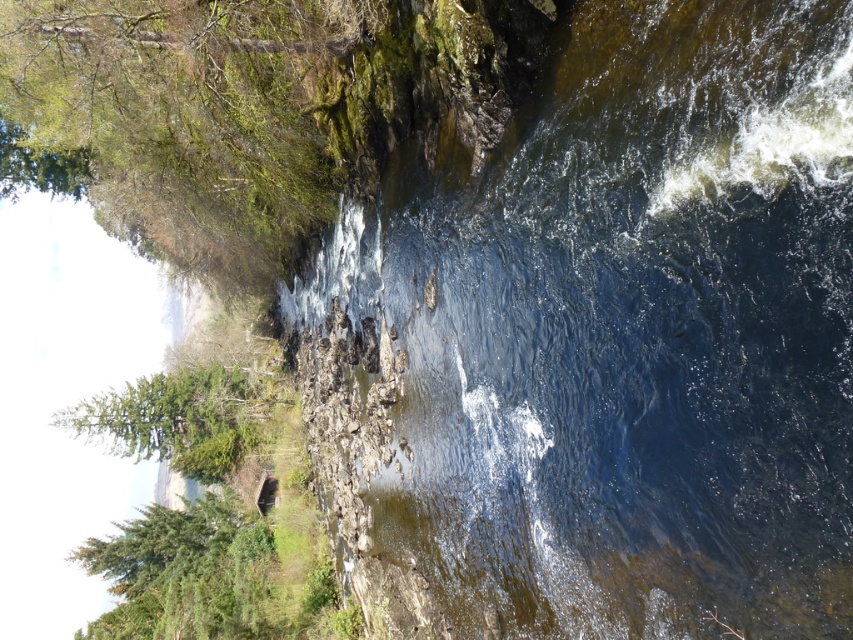
Can you confirm if clear water at center is positioned above green matte tree at lower left?

Yes, clear water at center is above green matte tree at lower left.

Is point (762, 113) farther from camera compared to point (270, 628)?

That is False.

Find the location of `clear water at center`. clear water at center is located at coordinates (625, 336).

Which is behind, point (219, 573) or point (157, 448)?

Point (157, 448)

Is point (270, 540) closer to viewer compared to point (181, 406)?

Yes, point (270, 540) is closer to viewer.

Locate an element on the screen. This screenshot has width=853, height=640. green matte tree at lower left is located at coordinates click(x=183, y=573).

Measure the distance between point (410,307) and camera.

A distance of 107.54 feet exists between point (410,307) and camera.

Which is in front, point (498, 621) or point (196, 432)?

Point (498, 621) is in front.

Who is more distant from viewer, (485, 449) or (201, 419)?

Positioned behind is point (201, 419).

The image size is (853, 640). Identify the location of clear water at center. (625, 336).